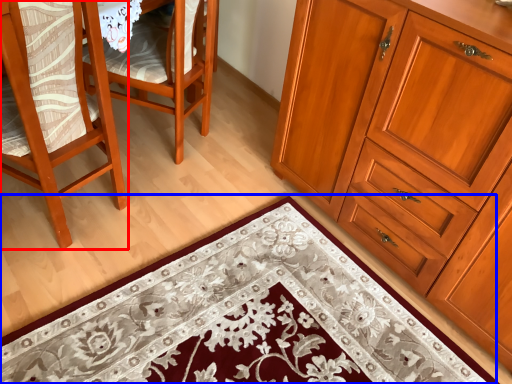
Question: Which of the following is the farthest to the observer, chair (highlighted by a red box) or doormat (highlighted by a blue box)?

Choices:
 (A) chair
 (B) doormat

Answer: (A)